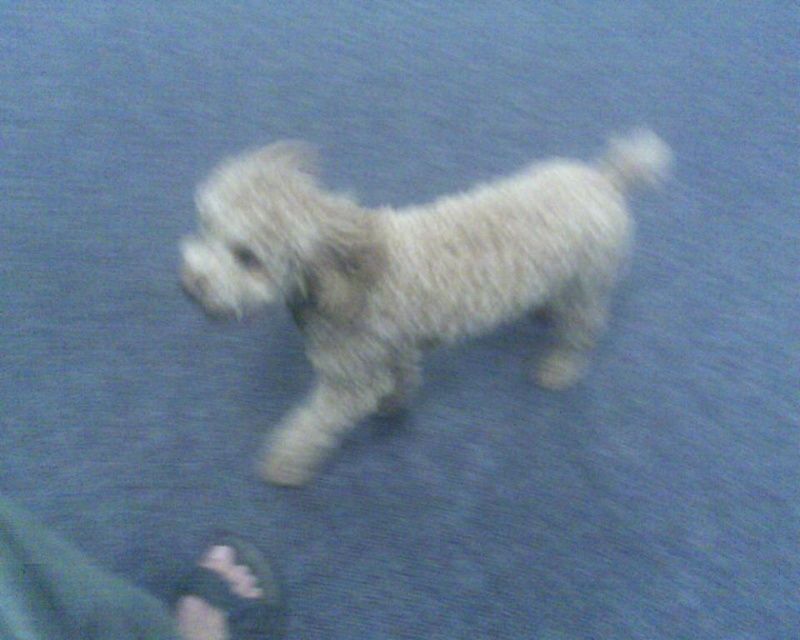
You are trying to decide if the white fluffy dog at center can fit through a narrow doorway that is the same width as the black fabric sandal at lower left. Based on their sizes, what do you think?

The white fluffy dog at center is wider than the black fabric sandal at lower left, so it may not fit through a doorway that is the same width as the sandal.

You are a dog trainer observing the scene. You need to determine which item is taller between the green fabric pants at lower left and the black fabric sandal at lower left. Which one is taller?

The green fabric pants at lower left is taller than the black fabric sandal at lower left according to the description.